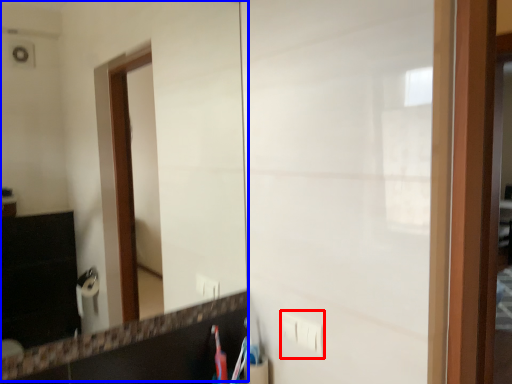
Question: Among these objects, which one is farthest to the camera, electric outlet (highlighted by a red box) or mirror (highlighted by a blue box)?

Choices:
 (A) electric outlet
 (B) mirror

Answer: (A)